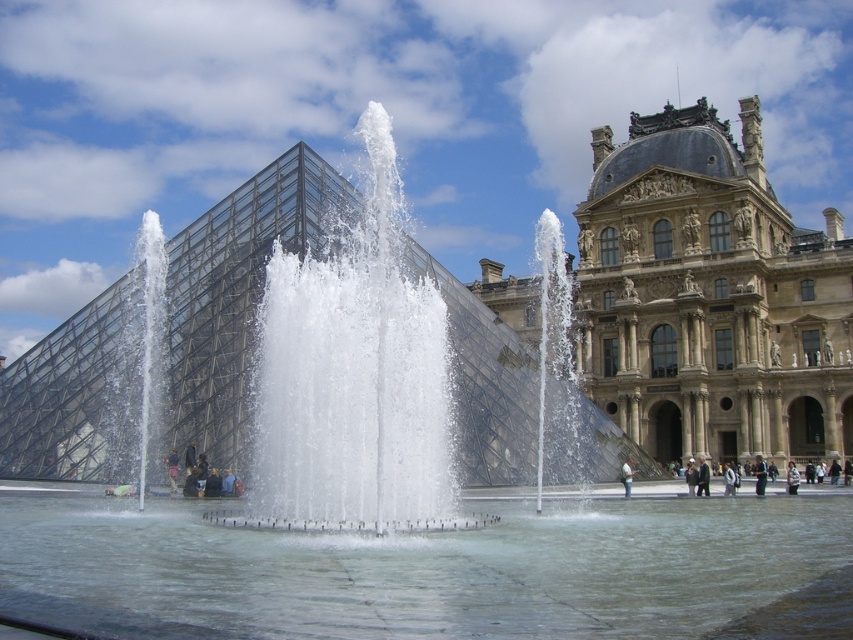
You are an art student sketching the Louvre Pyramid and the Louvre Palace. You notice the clear water at center and the dark gray stone people at lower right in your drawing. Which object is positioned higher in the scene?

The clear water at center is located above the dark gray stone people at lower right, so it is positioned higher in the scene.

You are standing in the foreground of the scene and want to reach the dark blue jeans at center without stepping into the clear water at center. Is this possible?

The clear water at center is closer to the viewer than dark blue jeans at center, so you would have to step through the clear water at center to reach the dark blue jeans at center.